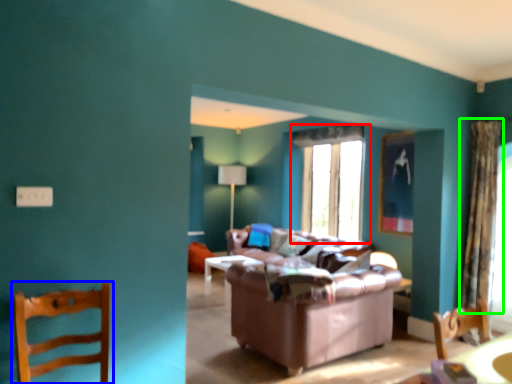
Question: Considering the real-world distances, which object is farthest from window (highlighted by a red box)? chair (highlighted by a blue box) or curtain (highlighted by a green box)?

Choices:
 (A) chair
 (B) curtain

Answer: (A)